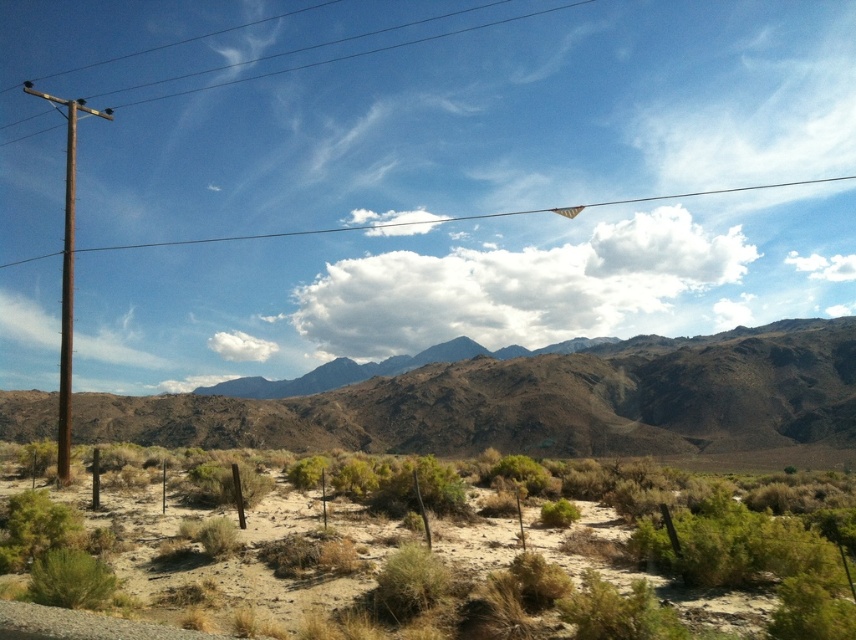
Question: Based on their relative distances, which object is farther from the brown wooden pole at left?

Choices:
 (A) brown wooden pole at upper left
 (B) brown rocky mountain range at center
 (C) rusty wood telegraph pole at left

Answer: (A)

Question: Among these objects, which one is farthest from the camera?

Choices:
 (A) brown wooden pole at upper left
 (B) brown wooden pole at left

Answer: (A)

Question: Can you confirm if brown rocky mountain range at center is smaller than brown wooden pole at left?

Choices:
 (A) yes
 (B) no

Answer: (A)

Question: Does brown wooden pole at upper left have a smaller size compared to brown wooden pole at left?

Choices:
 (A) no
 (B) yes

Answer: (B)

Question: Which is nearer to the brown rocky mountain range at center?

Choices:
 (A) brown wooden pole at upper left
 (B) green shrubbery at center
 (C) brown wooden pole at left
 (D) rusty wood telegraph pole at left

Answer: (B)

Question: Can you confirm if brown rocky mountain range at center is positioned above rusty wood telegraph pole at left?

Choices:
 (A) no
 (B) yes

Answer: (A)